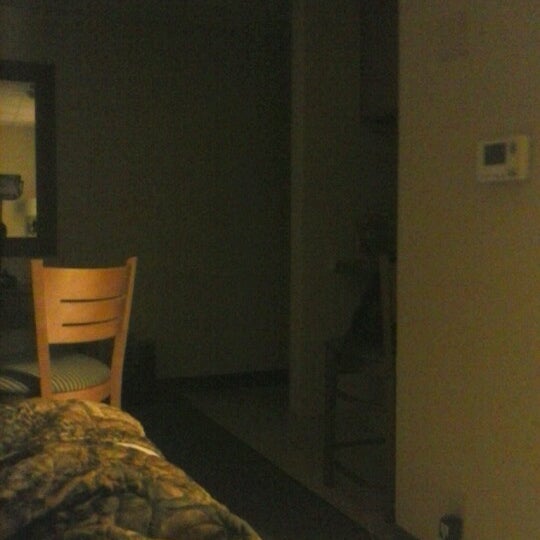
Image resolution: width=540 pixels, height=540 pixels. In order to click on chair in this screenshot , I will do click(x=100, y=288), click(x=64, y=389).